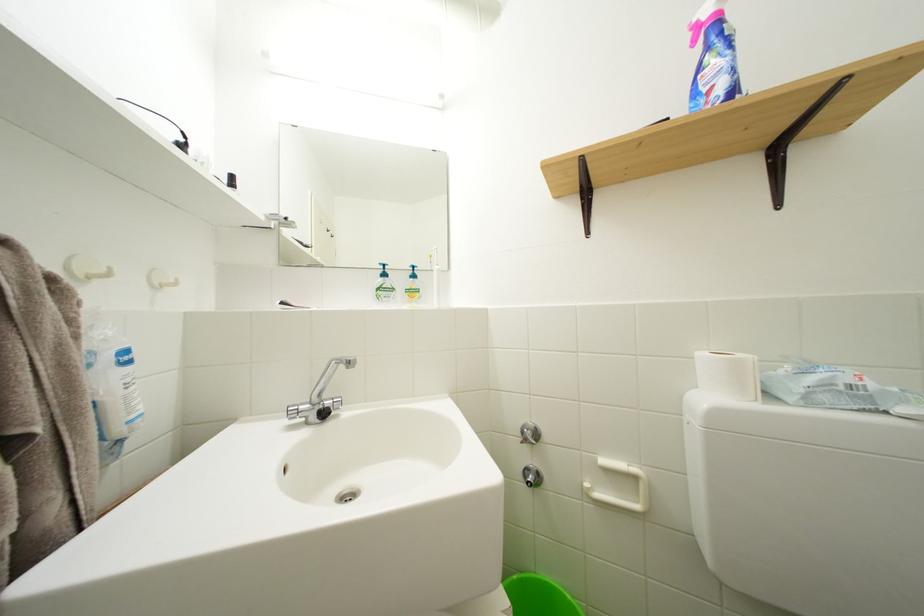
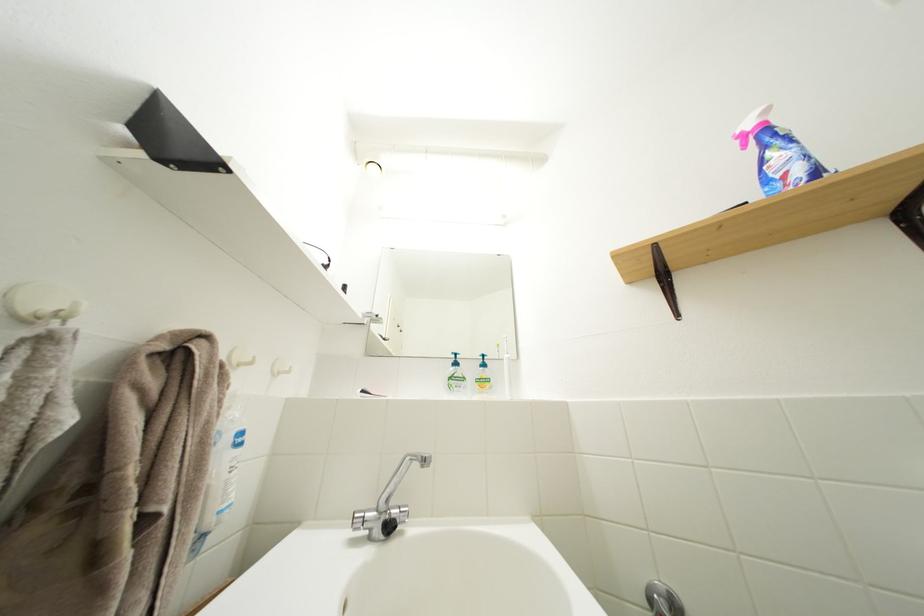
Find the pixel in the second image that matches (x=387, y=294) in the first image.

(458, 384)